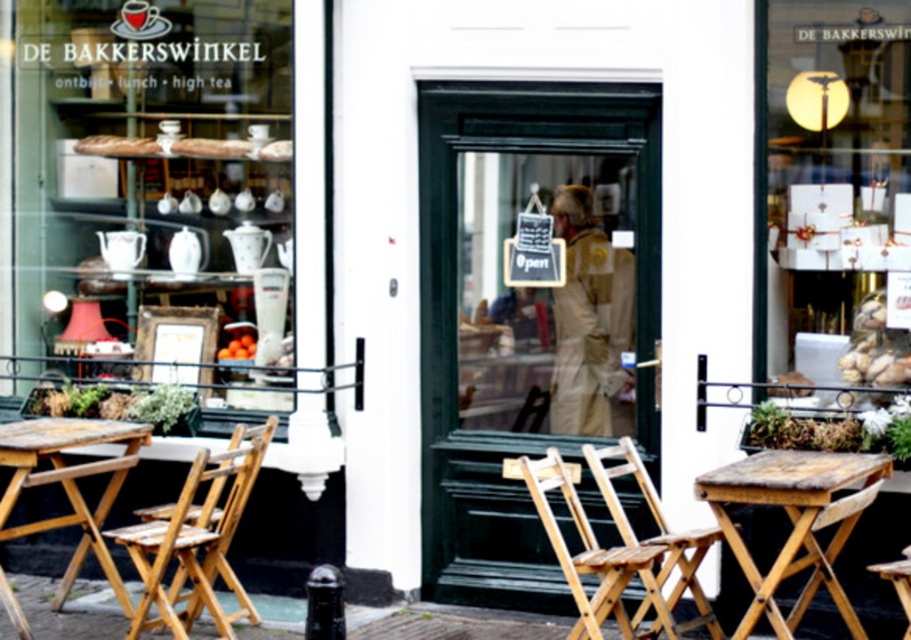
Is matte white ceramic teapot at upper center below wooden rustic table at center?

Incorrect, matte white ceramic teapot at upper center is not positioned below wooden rustic table at center.

Measure the distance between matte white ceramic teapot at upper center and wooden rustic table at center.

matte white ceramic teapot at upper center and wooden rustic table at center are 3.75 meters apart.

Measure the distance between matte white ceramic teapot at upper center and camera.

matte white ceramic teapot at upper center is 31.44 feet away from camera.

You are a GUI agent. You are given a task and a screenshot of the screen. Output one action in this format:
    pyautogui.click(x=<x>, y=<y>)
    Task: Click on the matte white ceramic teapot at upper center
    Image resolution: width=911 pixels, height=640 pixels.
    Given the screenshot: What is the action you would take?
    pyautogui.click(x=154, y=195)

Which is below, white paper gift boxes at upper center or wooden rustic table at center?

wooden rustic table at center is lower down.

Does white paper gift boxes at upper center appear on the right side of wooden rustic table at center?

Correct, you'll find white paper gift boxes at upper center to the right of wooden rustic table at center.

Measure the distance between point (x=847, y=170) and camera.

The distance of point (x=847, y=170) from camera is 28.87 feet.

The height and width of the screenshot is (640, 911). I want to click on white paper gift boxes at upper center, so tap(827, 163).

Is white paper gift boxes at upper center shorter than wooden table at lower left?

No, white paper gift boxes at upper center is not shorter than wooden table at lower left.

Does white paper gift boxes at upper center have a greater width compared to wooden table at lower left?

In fact, white paper gift boxes at upper center might be narrower than wooden table at lower left.

Between point (802, 92) and point (11, 492), which one is positioned in front?

Point (11, 492)

Identify the location of white paper gift boxes at upper center. The height and width of the screenshot is (640, 911). (827, 163).